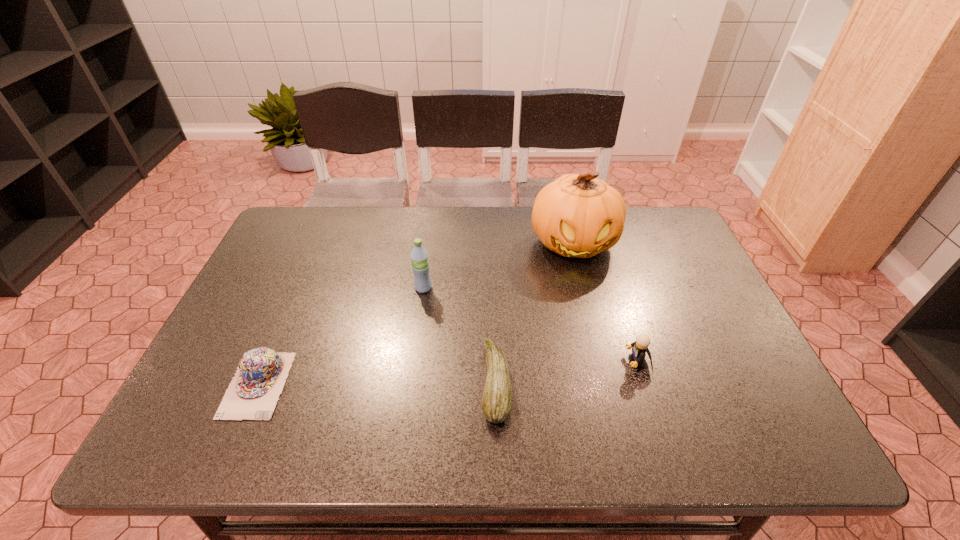
Image resolution: width=960 pixels, height=540 pixels. I want to click on vacant space that is in between the cap and the pumpkin, so click(416, 314).

What are the coordinates of `free space between the zucchini and the pumpkin` in the screenshot? It's located at (535, 313).

The height and width of the screenshot is (540, 960). What are the coordinates of `vacant area between the Lego and the fourth shortest object` in the screenshot? It's located at (530, 325).

Where is `vacant space that's between the water bottle and the third object from right to left`? The image size is (960, 540). vacant space that's between the water bottle and the third object from right to left is located at coordinates (460, 335).

Identify the location of vacant space in between the tallest object and the Lego. (606, 302).

Find the location of a particular element. This screenshot has height=540, width=960. vacant region between the farthest object and the third shortest object is located at coordinates (606, 302).

Find the location of a particular element. This screenshot has height=540, width=960. free space between the third shortest object and the cap is located at coordinates (447, 373).

In order to click on object that stands as the second closest to the cap in this screenshot , I will do `click(497, 398)`.

Identify which object is the second closest to the zucchini. Please provide its 2D coordinates. Your answer should be formatted as a tuple, i.e. [(x, y)], where the tuple contains the x and y coordinates of a point satisfying the conditions above.

[(576, 215)]

Where is `vacant space that satisfies the following two spatial constraints: 1. at the stem end of the third object from right to left; 2. on the front, side, and top of the leftmost object`? The image size is (960, 540). vacant space that satisfies the following two spatial constraints: 1. at the stem end of the third object from right to left; 2. on the front, side, and top of the leftmost object is located at coordinates (496, 384).